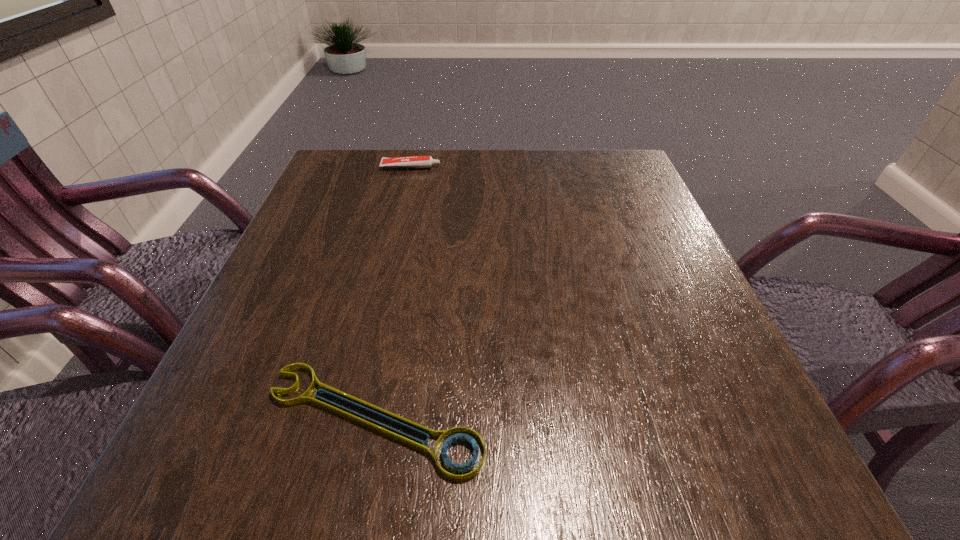
Identify the location of vacant position in the image that satisfies the following two spatial constraints: 1. at the nozzle of the wrench; 2. on the right side of the toothpaste. This screenshot has height=540, width=960. (353, 419).